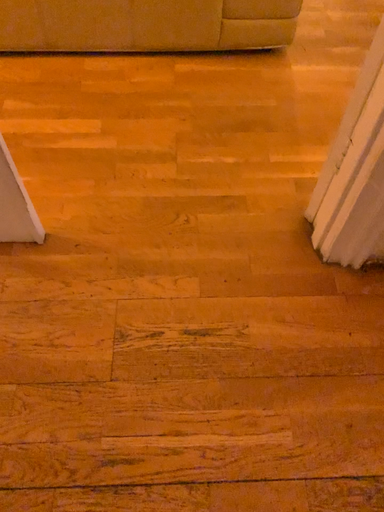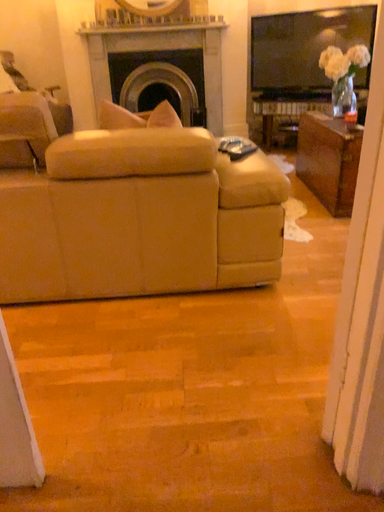
Question: Which way did the camera rotate in the video?

Choices:
 (A) rotated downward
 (B) rotated upward

Answer: (B)